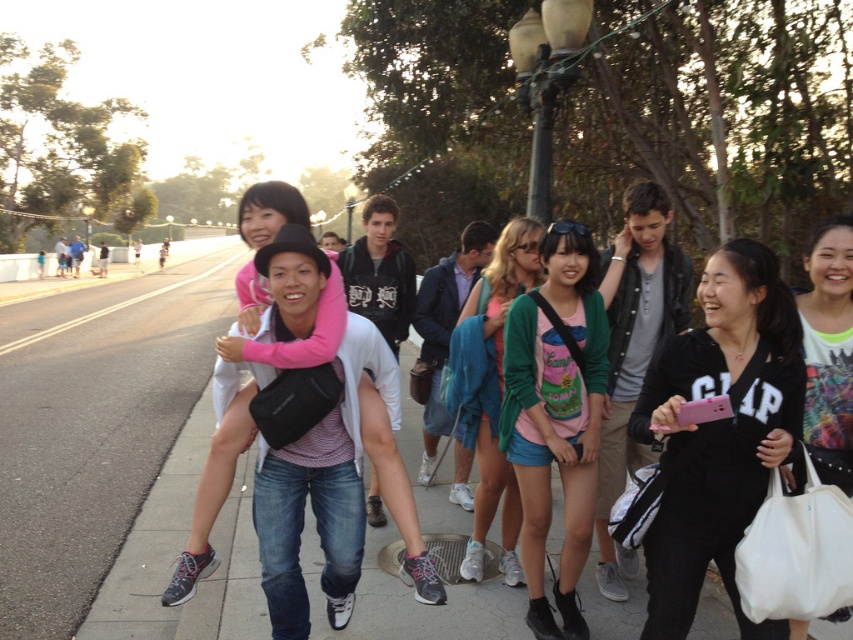
Is black zip-up hoodie at center positioned in front of matte pink shirt at center?

Yes, black zip-up hoodie at center is closer to the viewer.

Consider the image. Does black zip-up hoodie at center have a greater width compared to matte pink shirt at center?

Yes, black zip-up hoodie at center is wider than matte pink shirt at center.

Which is behind, point (660, 385) or point (512, 246)?

Point (512, 246)

At what (x,y) coordinates should I click in order to perform the action: click on black zip-up hoodie at center. Please return your answer as a coordinate pair (x, y). The height and width of the screenshot is (640, 853). Looking at the image, I should click on (720, 433).

Is gray asphalt sidewalk at lower left wider than matte green sweater at center?

Yes, gray asphalt sidewalk at lower left is wider than matte green sweater at center.

Between point (32, 348) and point (537, 307), which one is positioned in front?

Positioned in front is point (537, 307).

The width and height of the screenshot is (853, 640). In order to click on gray asphalt sidewalk at lower left in this screenshot , I will do `click(91, 428)`.

Based on the photo, does white fabric bag at lower right appear under matte pink shirt at center?

No, white fabric bag at lower right is not below matte pink shirt at center.

Does white fabric bag at lower right have a greater width compared to matte pink shirt at center?

Correct, the width of white fabric bag at lower right exceeds that of matte pink shirt at center.

Image resolution: width=853 pixels, height=640 pixels. Describe the element at coordinates (828, 349) in the screenshot. I see `white fabric bag at lower right` at that location.

Identify the location of white fabric bag at lower right. This screenshot has height=640, width=853. (828, 349).